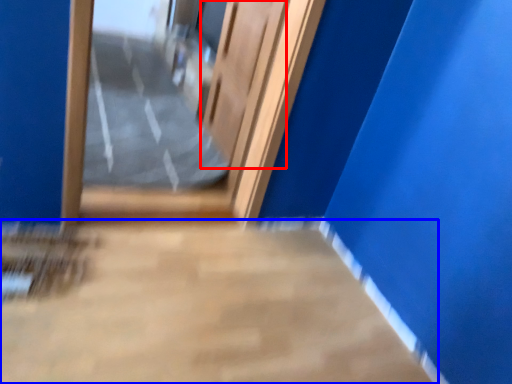
Question: Which object is closer to the camera taking this photo, elevator door (highlighted by a red box) or concrete (highlighted by a blue box)?

Choices:
 (A) elevator door
 (B) concrete

Answer: (B)